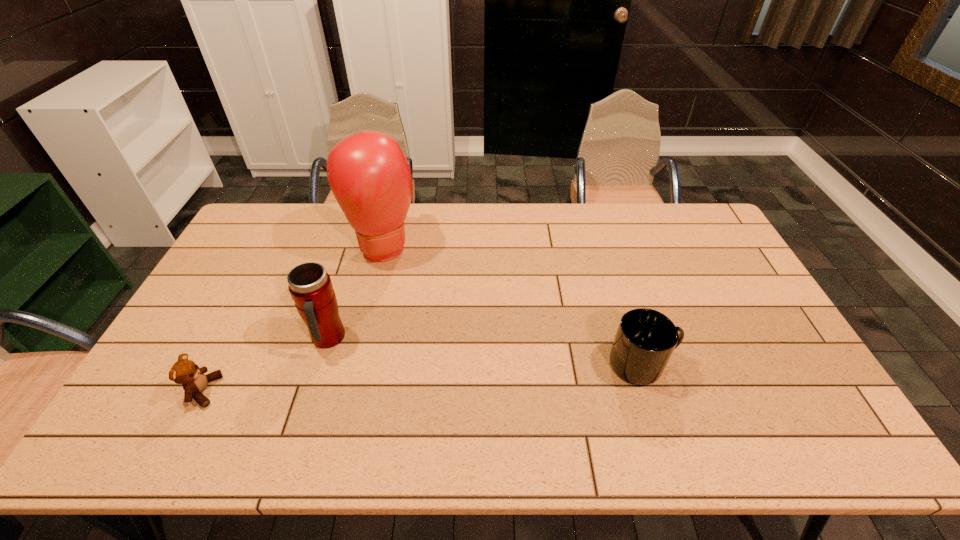
Locate an element on the screen. Image resolution: width=960 pixels, height=540 pixels. vacant space on the desktop that is between the leftmost object and the third tallest object and is positioned on the side with the handle of the second tallest object is located at coordinates (374, 381).

The height and width of the screenshot is (540, 960). I want to click on free space on the desktop that is between the shortest object and the rightmost object and is positioned on the striking surface of the farthest object, so click(443, 376).